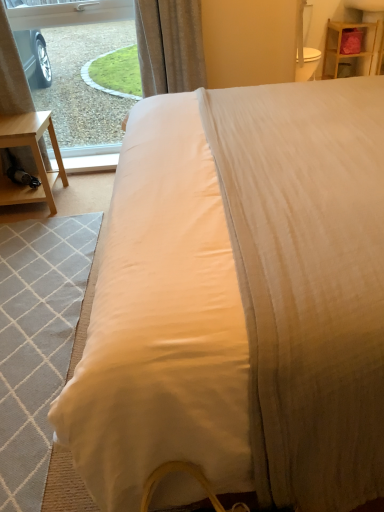
Question: From a real-world perspective, is wooden shelf at upper right beneath light gray woven mat at lower left?

Choices:
 (A) no
 (B) yes

Answer: (A)

Question: From the image's perspective, would you say wooden shelf at upper right is positioned over light gray woven mat at lower left?

Choices:
 (A) no
 (B) yes

Answer: (B)

Question: Does wooden shelf at upper right appear on the right side of light gray woven mat at lower left?

Choices:
 (A) no
 (B) yes

Answer: (B)

Question: Does wooden shelf at upper right have a lesser width compared to light gray woven mat at lower left?

Choices:
 (A) no
 (B) yes

Answer: (B)

Question: Considering the relative positions of wooden shelf at upper right and light gray woven mat at lower left in the image provided, is wooden shelf at upper right behind light gray woven mat at lower left?

Choices:
 (A) yes
 (B) no

Answer: (A)

Question: Is wooden shelf at upper right positioned beyond the bounds of light gray woven mat at lower left?

Choices:
 (A) no
 (B) yes

Answer: (B)

Question: From a real-world perspective, is wooden shelf at upper right over transparent glass window at upper left?

Choices:
 (A) yes
 (B) no

Answer: (B)

Question: Is wooden shelf at upper right behind transparent glass window at upper left?

Choices:
 (A) yes
 (B) no

Answer: (A)

Question: Can you confirm if wooden shelf at upper right is shorter than transparent glass window at upper left?

Choices:
 (A) yes
 (B) no

Answer: (A)

Question: Considering the relative sizes of wooden shelf at upper right and transparent glass window at upper left in the image provided, is wooden shelf at upper right wider than transparent glass window at upper left?

Choices:
 (A) no
 (B) yes

Answer: (B)

Question: From the image's perspective, is wooden shelf at upper right beneath transparent glass window at upper left?

Choices:
 (A) yes
 (B) no

Answer: (B)

Question: Is wooden shelf at upper right outside transparent glass window at upper left?

Choices:
 (A) no
 (B) yes

Answer: (B)

Question: Can you confirm if light gray woven mat at lower left is wider than transparent glass window at upper left?

Choices:
 (A) yes
 (B) no

Answer: (A)